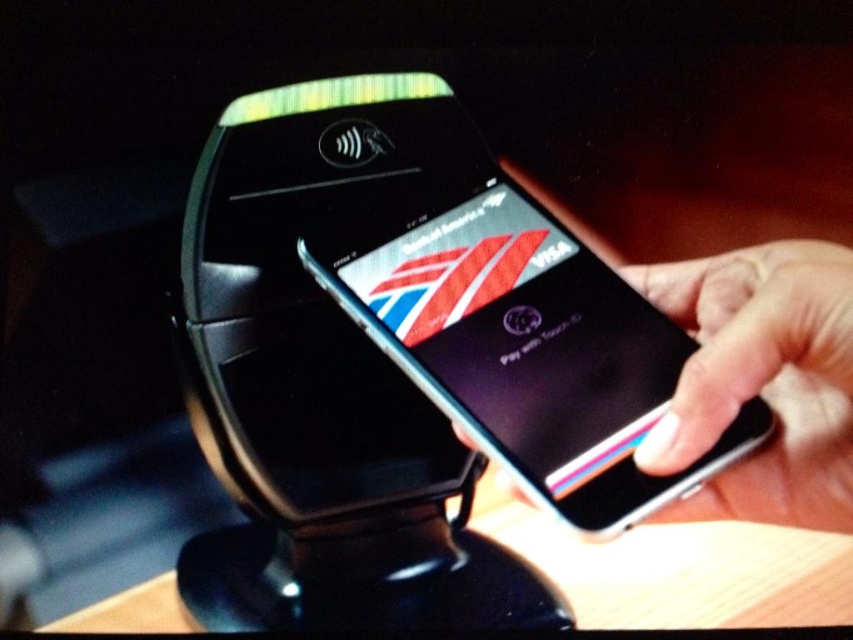
Question: Is metallic silver smartphone at center to the left of white matte phone at right from the viewer's perspective?

Choices:
 (A) yes
 (B) no

Answer: (A)

Question: Which point is closer to the camera taking this photo?

Choices:
 (A) (822, 253)
 (B) (556, 346)

Answer: (A)

Question: Can you confirm if metallic silver smartphone at center is wider than white matte phone at right?

Choices:
 (A) yes
 (B) no

Answer: (A)

Question: Is metallic silver smartphone at center positioned at the back of white matte phone at right?

Choices:
 (A) no
 (B) yes

Answer: (B)